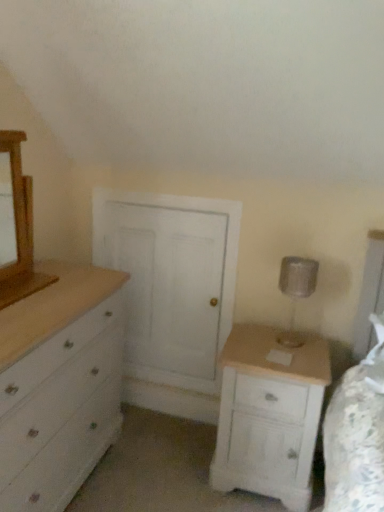
Question: From the image's perspective, is wooden medicine cabinet at left located above or below white painted wood chest of drawers at left?

Choices:
 (A) above
 (B) below

Answer: (A)

Question: Considering the positions of wooden medicine cabinet at left and white painted wood chest of drawers at left in the image, is wooden medicine cabinet at left taller or shorter than white painted wood chest of drawers at left?

Choices:
 (A) short
 (B) tall

Answer: (A)

Question: Based on their relative distances, which object is nearer to the silver metallic table lamp at right?

Choices:
 (A) wooden medicine cabinet at left
 (B) white painted wood chest of drawers at left
 (C) white wood nightstand at lower right

Answer: (C)

Question: Which object is positioned farthest from the white wood nightstand at lower right?

Choices:
 (A) silver metallic table lamp at right
 (B) white painted wood chest of drawers at left
 (C) wooden medicine cabinet at left

Answer: (C)